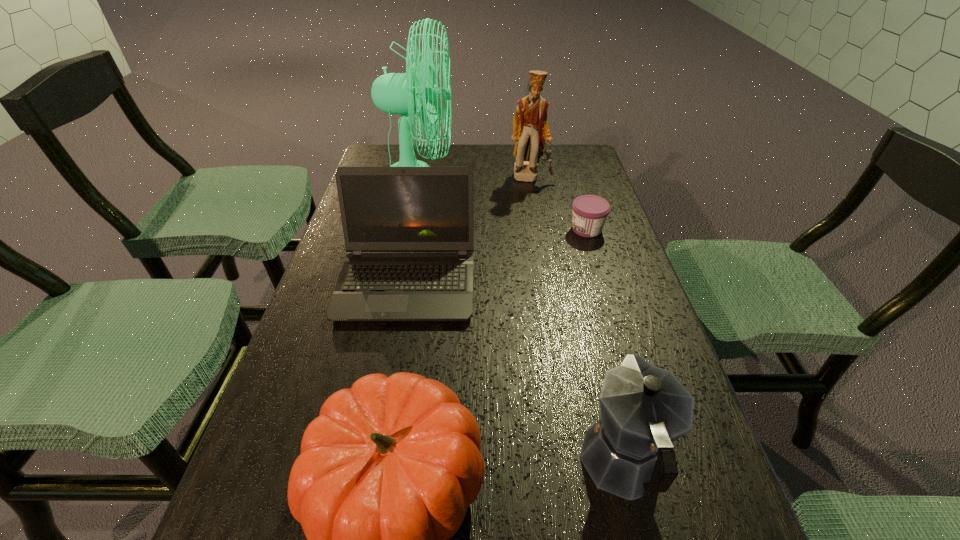
Locate an element on the screen. The width and height of the screenshot is (960, 540). the tallest object is located at coordinates (395, 93).

Where is `the fifth shortest object`? the fifth shortest object is located at coordinates (531, 132).

Identify the location of laptop_computer. (409, 230).

I want to click on coffeepot, so click(628, 452).

Where is `the shortest object`? the shortest object is located at coordinates click(590, 212).

Image resolution: width=960 pixels, height=540 pixels. Identify the location of the third farthest object. point(590,212).

What are the coordinates of `free space located 0.260m in front of the tallest object to blow air` in the screenshot? It's located at (536, 181).

Where is `vacant point located 0.180m on the front-facing side of the nutcracker`? The image size is (960, 540). vacant point located 0.180m on the front-facing side of the nutcracker is located at coordinates (539, 218).

This screenshot has width=960, height=540. What are the coordinates of `free space located on the screen of the fourth farthest object` in the screenshot? It's located at (378, 440).

What are the coordinates of `vacant space located 0.300m at the spout of the coffeepot` in the screenshot? It's located at (582, 295).